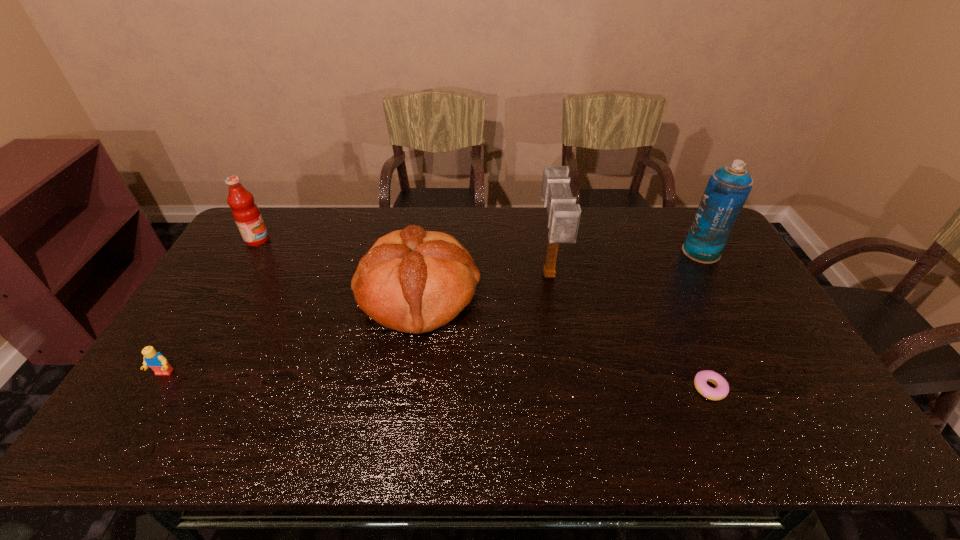
Where is `object that is at the far right corner`? Image resolution: width=960 pixels, height=540 pixels. object that is at the far right corner is located at coordinates (727, 190).

The image size is (960, 540). Identify the location of vacant position at the far edge of the desktop. (645, 207).

Identify the location of vacant space at the left edge of the desktop. This screenshot has height=540, width=960. (230, 320).

In the image, there is a desktop. Where is `vacant space at the right edge`? vacant space at the right edge is located at coordinates (790, 403).

Image resolution: width=960 pixels, height=540 pixels. I want to click on blank space at the far left corner of the desktop, so click(271, 220).

You are a GUI agent. You are given a task and a screenshot of the screen. Output one action in this format:
    pyautogui.click(x=<x>, y=<y>)
    Task: Click on the unoccupied position between the Lego and the third object from right to left
    Image resolution: width=960 pixels, height=540 pixels.
    Given the screenshot: What is the action you would take?
    pyautogui.click(x=356, y=325)

Image resolution: width=960 pixels, height=540 pixels. Identify the location of free space between the aerosol can and the doughnut. [706, 320].

Find the location of `free space between the doughnut and the bread`. free space between the doughnut and the bread is located at coordinates (564, 341).

Image resolution: width=960 pixels, height=540 pixels. What are the coordinates of `free space between the rightmost object and the mallet` in the screenshot? It's located at (625, 264).

The image size is (960, 540). Identify the location of free spot between the Lego and the third object from right to left. (356, 325).